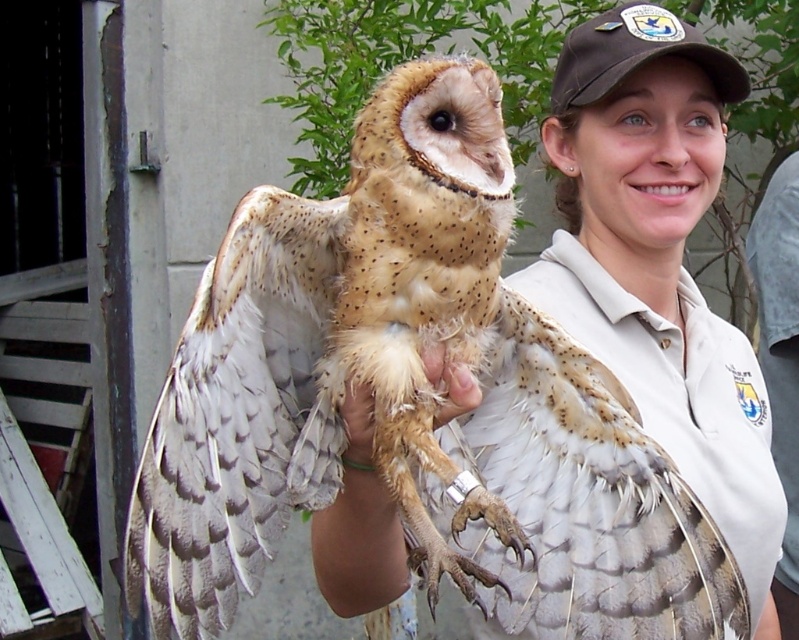
Is speckled feathered owl at center to the right of fuzzy beige feathers at center from the viewer's perspective?

Correct, you'll find speckled feathered owl at center to the right of fuzzy beige feathers at center.

Between speckled feathered owl at center and fuzzy beige feathers at center, which one has more height?

speckled feathered owl at center is taller.

Is point (615, 460) closer to camera compared to point (464, 392)?

No, it is not.

Find the location of a particular element. This screenshot has height=640, width=799. speckled feathered owl at center is located at coordinates (412, 403).